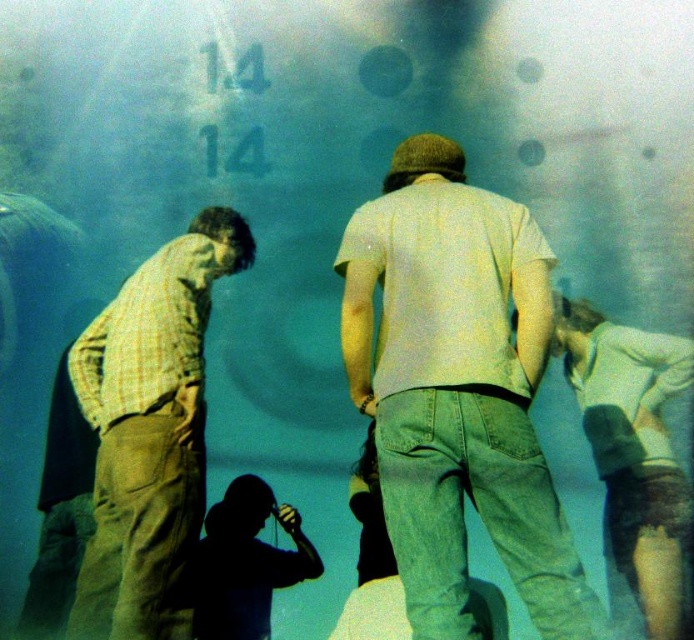
Question: Does light gray cotton shirt at center appear under light blue denim shorts at lower right?

Choices:
 (A) yes
 (B) no

Answer: (B)

Question: Which is nearer to the light gray cotton shirt at center?

Choices:
 (A) light blue denim shorts at lower right
 (B) checkered fabric shirt at left

Answer: (B)

Question: Which point is closer to the camera taking this photo?

Choices:
 (A) (194, 260)
 (B) (625, 364)

Answer: (A)

Question: From the image, what is the correct spatial relationship of checkered fabric shirt at left in relation to light blue denim shorts at lower right?

Choices:
 (A) above
 (B) below

Answer: (A)

Question: Among these points, which one is nearest to the camera?

Choices:
 (A) (465, 220)
 (B) (160, 396)
 (C) (682, 484)

Answer: (A)

Question: From the image, what is the correct spatial relationship of light gray cotton shirt at center in relation to light blue denim shorts at lower right?

Choices:
 (A) right
 (B) left

Answer: (B)